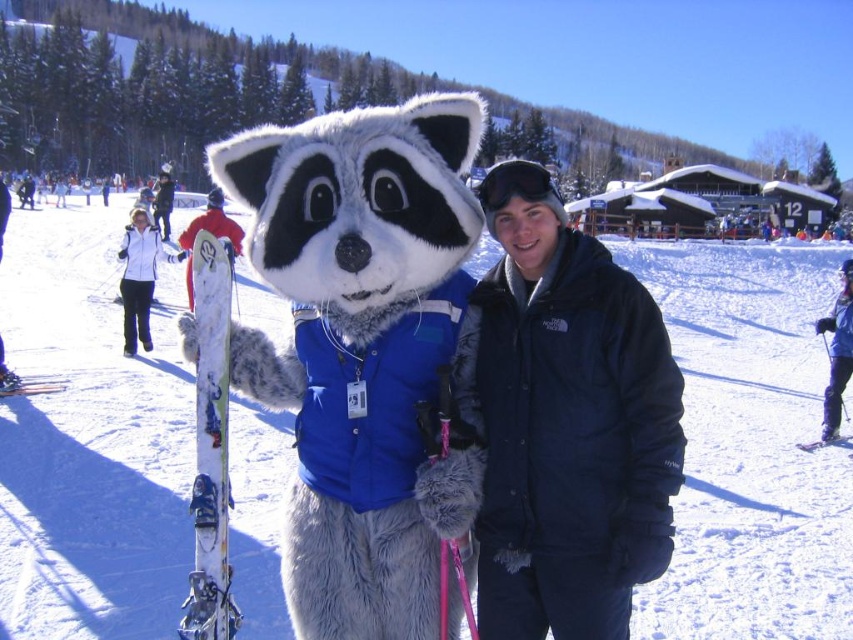
Question: Among these objects, which one is nearest to the camera?

Choices:
 (A) white matte ski at lower left
 (B) dark blue puffy jacket at center
 (C) white fluffy mascot at center
 (D) black matte goggles at center

Answer: (B)

Question: Can you confirm if white glossy skis at left is wider than white fleece jacket at left?

Choices:
 (A) yes
 (B) no

Answer: (B)

Question: Among these objects, which one is nearest to the camera?

Choices:
 (A) white fluffy mascot at center
 (B) white plastic ski at lower right
 (C) white matte ski at lower left
 (D) black matte goggles at center

Answer: (D)

Question: Estimate the real-world distances between objects in this image. Which object is closer to the dark blue puffy jacket at center?

Choices:
 (A) white matte ski at lower left
 (B) white plastic ski at lower right

Answer: (B)

Question: Is white fluffy mascot at center further to camera compared to black matte goggles at center?

Choices:
 (A) no
 (B) yes

Answer: (B)

Question: Can you confirm if white fleece jacket at left is positioned above black matte goggles at center?

Choices:
 (A) no
 (B) yes

Answer: (A)